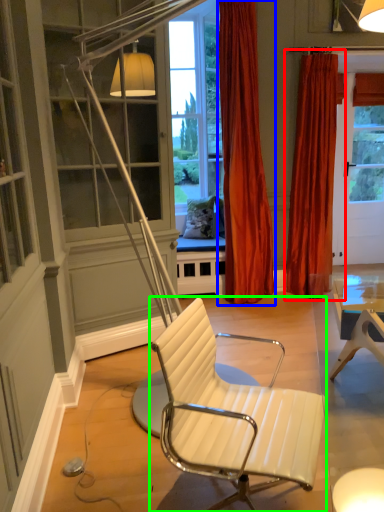
Question: Estimate the real-world distances between objects in this image. Which object is closer to curtain (highlighted by a red box), curtain (highlighted by a blue box) or chair (highlighted by a green box)?

Choices:
 (A) curtain
 (B) chair

Answer: (A)